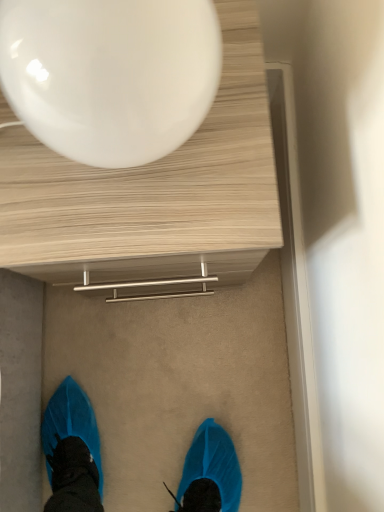
Describe the element at coordinates (110, 74) in the screenshot. The width and height of the screenshot is (384, 512). I see `glossy white balloon at upper center` at that location.

Identify the location of glossy white balloon at upper center. This screenshot has width=384, height=512. (110, 74).

This screenshot has width=384, height=512. Describe the element at coordinates (152, 196) in the screenshot. I see `wooden table at upper center` at that location.

In order to face wooden table at upper center, should I rotate leftwards or rightwards?

To face it directly, rotate left by 5.978 degrees.

You are a GUI agent. You are given a task and a screenshot of the screen. Output one action in this format:
    pyautogui.click(x=<x>, y=<y>)
    Task: Click on the wooden table at upper center
    The width and height of the screenshot is (384, 512).
    Given the screenshot: What is the action you would take?
    pyautogui.click(x=152, y=196)

Image resolution: width=384 pixels, height=512 pixels. What are the coordinates of `glossy white balloon at upper center` in the screenshot? It's located at click(110, 74).

Which object is positioned more to the left, glossy white balloon at upper center or wooden table at upper center?

glossy white balloon at upper center.

In the scene shown: Between glossy white balloon at upper center and wooden table at upper center, which one is positioned behind?

wooden table at upper center is more distant.

Is point (115, 124) positioned before point (208, 174)?

Yes, point (115, 124) is closer to viewer.

From the image's perspective, is glossy white balloon at upper center positioned above or below wooden table at upper center?

glossy white balloon at upper center is above wooden table at upper center.

From a real-world perspective, is glossy white balloon at upper center under wooden table at upper center?

No, from a real-world perspective, glossy white balloon at upper center is not under wooden table at upper center.

Between glossy white balloon at upper center and wooden table at upper center, which one has larger width?

wooden table at upper center is wider.

From the picture: Considering the relative sizes of glossy white balloon at upper center and wooden table at upper center in the image provided, is glossy white balloon at upper center taller than wooden table at upper center?

In fact, glossy white balloon at upper center may be shorter than wooden table at upper center.

Which of these two, glossy white balloon at upper center or wooden table at upper center, is bigger?

With larger size is wooden table at upper center.

Is wooden table at upper center completely or partially inside glossy white balloon at upper center?

Definitely not — wooden table at upper center is not inside glossy white balloon at upper center.

Are glossy white balloon at upper center and wooden table at upper center located far from each other?

That's not correct — glossy white balloon at upper center is a little close to wooden table at upper center.

Is glossy white balloon at upper center turned away from wooden table at upper center?

No, wooden table at upper center is not at the back of glossy white balloon at upper center.

Can you tell me how much glossy white balloon at upper center and wooden table at upper center differ in facing direction?

The angle between the facing direction of glossy white balloon at upper center and the facing direction of wooden table at upper center is 0.000672 degrees.

How distant is glossy white balloon at upper center from wooden table at upper center?

glossy white balloon at upper center and wooden table at upper center are 7.26 inches apart.

The width and height of the screenshot is (384, 512). Find the location of `balloon located above the wooden table at upper center (from a real-world perspective)`. balloon located above the wooden table at upper center (from a real-world perspective) is located at coordinates (110, 74).

Looking at this image, which is more to the right, wooden table at upper center or glossy white balloon at upper center?

wooden table at upper center.

Is wooden table at upper center in front of glossy white balloon at upper center?

No, it is not.

Is point (241, 65) closer or farther from the camera than point (172, 18)?

Point (241, 65) is positioned farther from the camera compared to point (172, 18).

From the picture: From the image's perspective, which is below, wooden table at upper center or glossy white balloon at upper center?

wooden table at upper center, from the image's perspective.

From a real-world perspective, which is physically above, wooden table at upper center or glossy white balloon at upper center?

glossy white balloon at upper center.

Looking at their sizes, would you say wooden table at upper center is wider or thinner than glossy white balloon at upper center?

Clearly, wooden table at upper center has more width compared to glossy white balloon at upper center.

Who is taller, wooden table at upper center or glossy white balloon at upper center?

wooden table at upper center is taller.

In the scene shown: Who is smaller, wooden table at upper center or glossy white balloon at upper center?

glossy white balloon at upper center.

From the picture: Choose the correct answer: Is wooden table at upper center inside glossy white balloon at upper center or outside it?

wooden table at upper center is located beyond the bounds of glossy white balloon at upper center.

Is wooden table at upper center not close to glossy white balloon at upper center?

That's not correct — wooden table at upper center is a little close to glossy white balloon at upper center.

Looking at this image, is wooden table at upper center aimed at glossy white balloon at upper center?

No, wooden table at upper center is not oriented towards glossy white balloon at upper center.

You are a GUI agent. You are given a task and a screenshot of the screen. Output one action in this format:
    pyautogui.click(x=<x>, y=<y>)
    Task: Click on the table below the glossy white balloon at upper center (from a real-world perspective)
    This screenshot has width=384, height=512.
    Given the screenshot: What is the action you would take?
    pyautogui.click(x=152, y=196)

In order to click on table below the glossy white balloon at upper center (from the image's perspective) in this screenshot , I will do `click(152, 196)`.

This screenshot has width=384, height=512. I want to click on balloon above the wooden table at upper center (from the image's perspective), so click(x=110, y=74).